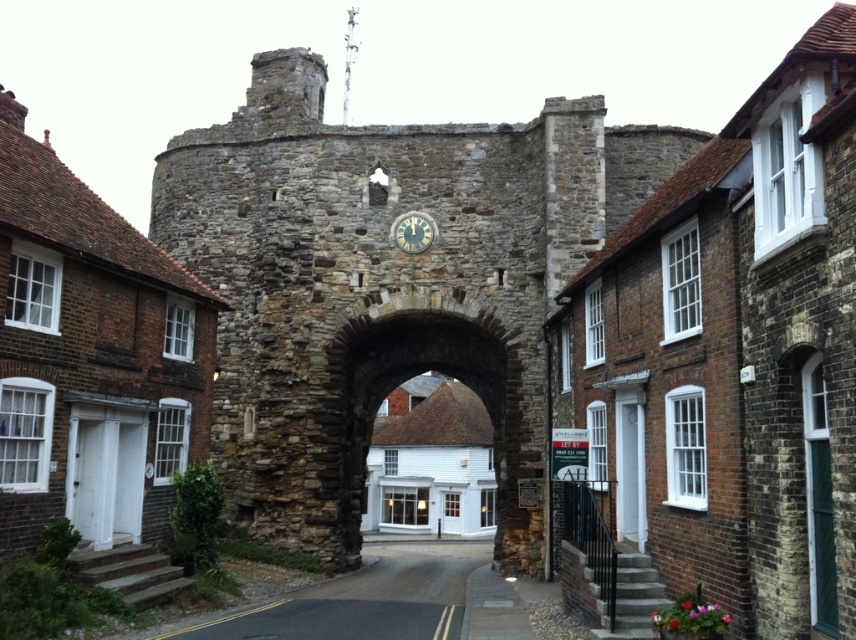
Question: Which object is closer to the camera taking this photo?

Choices:
 (A) stone archway at center
 (B) gold-toned metal clock at center
 (C) smooth asphalt road at center

Answer: (C)

Question: Which point is farther to the camera?

Choices:
 (A) smooth asphalt road at center
 (B) stone archway at center
 (C) gold-toned metal clock at center

Answer: (C)

Question: Does smooth asphalt road at center have a lesser width compared to gold-toned metal clock at center?

Choices:
 (A) yes
 (B) no

Answer: (B)

Question: Is smooth asphalt road at center to the left of gold-toned metal clock at center from the viewer's perspective?

Choices:
 (A) yes
 (B) no

Answer: (A)

Question: Which object is the farthest from the stone archway at center?

Choices:
 (A) smooth asphalt road at center
 (B) gold-toned metal clock at center

Answer: (B)

Question: Does stone archway at center appear over gold-toned metal clock at center?

Choices:
 (A) no
 (B) yes

Answer: (A)